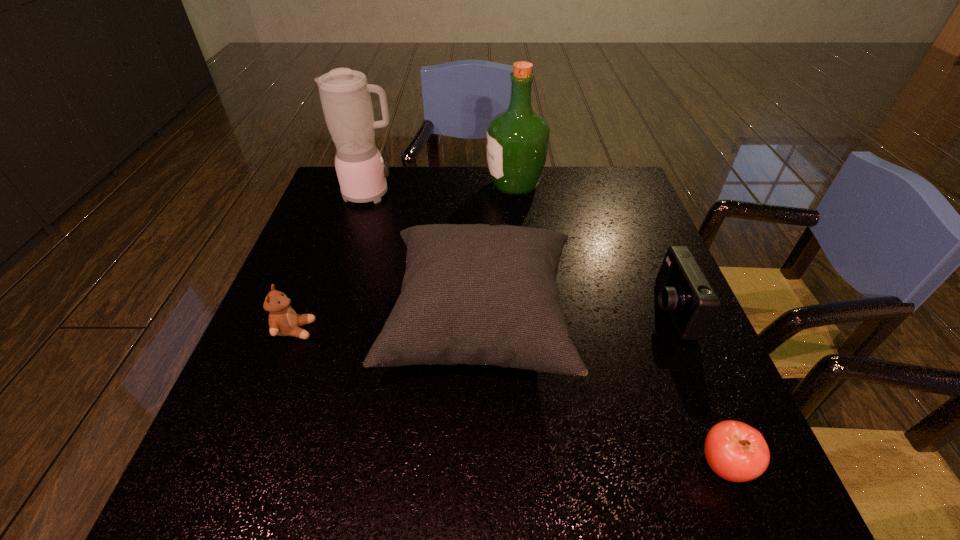
What are the coordinates of `vacant area between the camera and the liquor` in the screenshot? It's located at (592, 248).

I want to click on vacant area that lies between the liquor and the nearest object, so click(x=619, y=325).

Where is `blank region between the fourth shortest object and the camera`? The height and width of the screenshot is (540, 960). blank region between the fourth shortest object and the camera is located at coordinates (575, 318).

Find the location of a particular element. Image resolution: width=960 pixels, height=540 pixels. vacant space in between the liquor and the food processor is located at coordinates (444, 190).

Identify the location of object that is the fourth closest to the camera. This screenshot has height=540, width=960. (345, 96).

The height and width of the screenshot is (540, 960). Identify the location of object that is the third closest to the food processor. (283, 321).

In order to click on blank space that satisfies the following two spatial constraints: 1. on the back side of the apple; 2. on the base of the food processor near the control knob in this screenshot , I will do `click(615, 194)`.

This screenshot has height=540, width=960. Find the location of `vacant point that satisfies the following two spatial constraints: 1. on the front-facing side of the liquor; 2. on the back side of the nearest object`. vacant point that satisfies the following two spatial constraints: 1. on the front-facing side of the liquor; 2. on the back side of the nearest object is located at coordinates (544, 465).

Identify the location of free spot that satisfies the following two spatial constraints: 1. on the front side of the apple; 2. on the right side of the third tallest object. tap(480, 465).

Find the location of `blank area in the image that satisfies the following two spatial constraints: 1. on the base of the cushion near the control knob; 2. on the left side of the food processor`. blank area in the image that satisfies the following two spatial constraints: 1. on the base of the cushion near the control knob; 2. on the left side of the food processor is located at coordinates (329, 326).